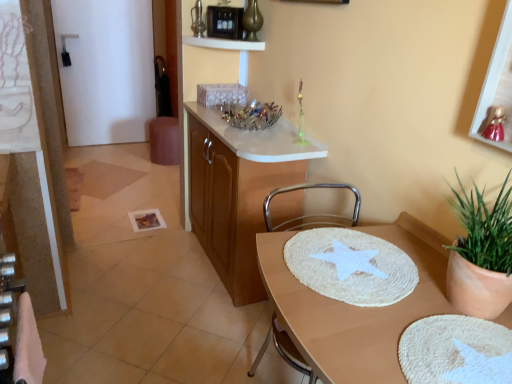
Question: Considering their positions, is white glossy door at upper left located in front of or behind white glossy shelf at upper center?

Choices:
 (A) behind
 (B) front

Answer: (A)

Question: From a real-world perspective, is white glossy door at upper left positioned above or below white glossy shelf at upper center?

Choices:
 (A) below
 (B) above

Answer: (A)

Question: Which is nearer to the white glossy door at upper left?

Choices:
 (A) metallic silver chair at center
 (B) black plastic microwave at upper center
 (C) gold metallic vase at upper center
 (D) wooden cabinet at center
 (E) beige woven placemat at center

Answer: (B)

Question: Estimate the real-world distances between objects in this image. Which object is closer to the black plastic microwave at upper center?

Choices:
 (A) white glossy shelf at upper center
 (B) metallic gold picture frame at upper right
 (C) metallic silver chair at center
 (D) white woven mat at center
 (E) gold metallic vase at upper center

Answer: (A)